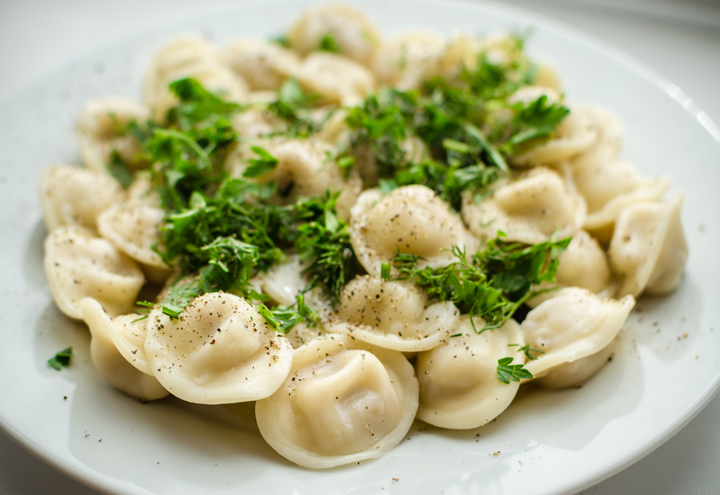
I want to click on table, so click(32, 30).